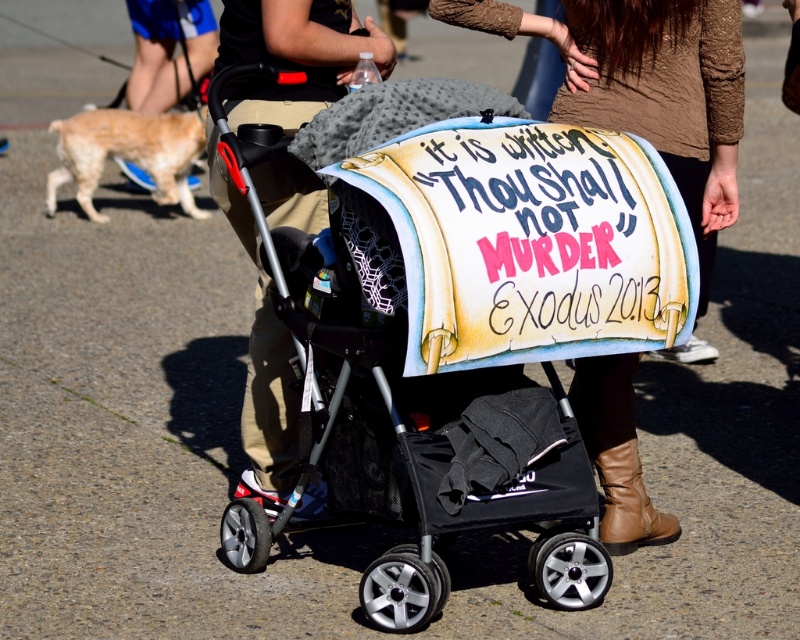
Who is higher up, matte black stroller at center or tan leather boot at lower right?

matte black stroller at center is higher up.

Consider the image. Can you confirm if matte black stroller at center is wider than tan leather boot at lower right?

Correct, the width of matte black stroller at center exceeds that of tan leather boot at lower right.

Which is in front, point (214, 138) or point (676, 531)?

Point (214, 138) is in front.

This screenshot has height=640, width=800. What are the coordinates of `matte black stroller at center` in the screenshot? It's located at (293, 54).

Is light brown fur at left closer to camera compared to tan leather boot at lower right?

No, it is not.

Is light brown fur at left above tan leather boot at lower right?

Yes.

Who is more distant from viewer, (173,147) or (630,522)?

Answer: Positioned behind is point (173,147).

The image size is (800, 640). Identify the location of light brown fur at left. (128, 154).

Who is positioned more to the right, black fabric baby carriage at center or light brown fur at left?

black fabric baby carriage at center

Does black fabric baby carriage at center appear on the right side of light brown fur at left?

Indeed, black fabric baby carriage at center is positioned on the right side of light brown fur at left.

Between point (314, 291) and point (100, 218), which one is positioned in front?

Point (314, 291) is more forward.

Find the location of a particular element. This screenshot has width=800, height=640. black fabric baby carriage at center is located at coordinates (422, 426).